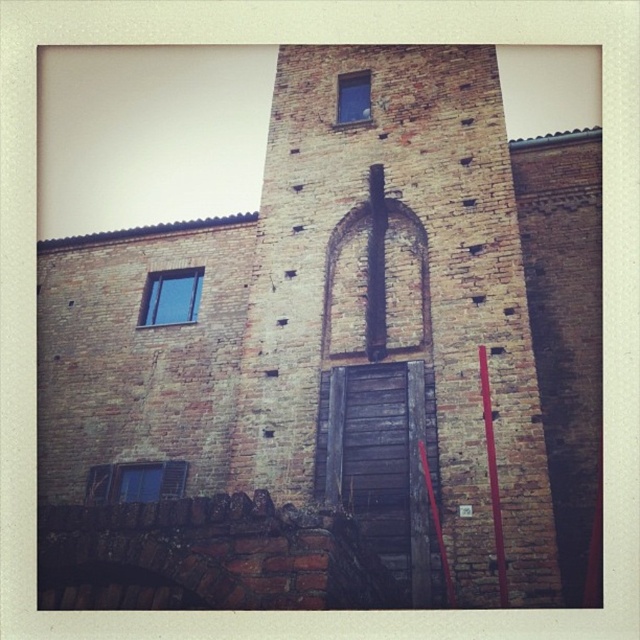
Can you confirm if wooden window frame at lower left is wider than clear glass window at upper left?

Yes, wooden window frame at lower left is wider than clear glass window at upper left.

Which of these two, wooden window frame at lower left or clear glass window at upper left, stands taller?

Standing taller between the two is clear glass window at upper left.

Is point (177, 490) farther from camera compared to point (186, 278)?

That is False.

In order to click on wooden window frame at lower left in this screenshot , I will do point(134,481).

Can you confirm if clear glass window at upper left is shorter than blue glass window at upper center?

In fact, clear glass window at upper left may be taller than blue glass window at upper center.

Locate an element on the screen. This screenshot has width=640, height=640. clear glass window at upper left is located at coordinates (170, 298).

Where is `clear glass window at upper left`? Image resolution: width=640 pixels, height=640 pixels. clear glass window at upper left is located at coordinates 170,298.

Can you confirm if wooden window frame at lower left is shorter than blue glass window at upper center?

Yes, wooden window frame at lower left is shorter than blue glass window at upper center.

Which is behind, point (156, 486) or point (365, 100)?

Positioned behind is point (365, 100).

I want to click on wooden window frame at lower left, so click(134, 481).